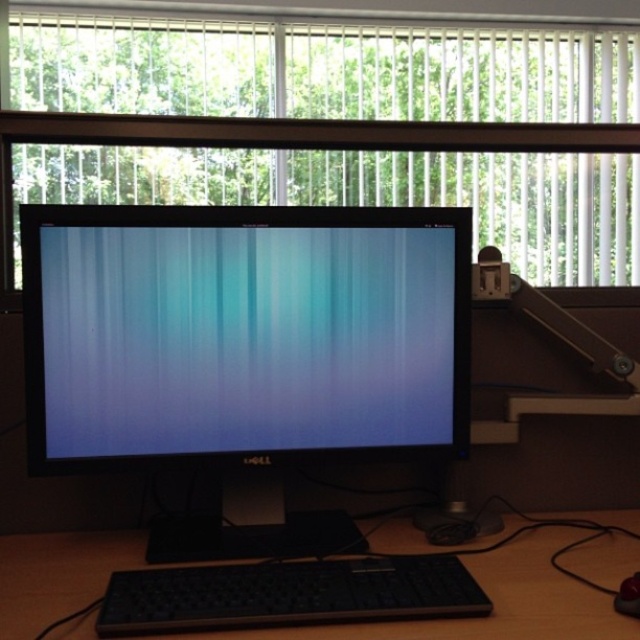
Question: Can you confirm if black plastic keyboard at lower center is positioned to the left of black plastic mouse at lower right?

Choices:
 (A) no
 (B) yes

Answer: (B)

Question: Is wooden table at lower center further to camera compared to black plastic keyboard at lower center?

Choices:
 (A) yes
 (B) no

Answer: (A)

Question: Estimate the real-world distances between objects in this image. Which object is closer to the matte black monitor at center?

Choices:
 (A) wooden table at lower center
 (B) transparent plastic window at upper center

Answer: (A)

Question: Which of the following is the farthest from the observer?

Choices:
 (A) black plastic mouse at lower right
 (B) transparent plastic window at upper center

Answer: (B)

Question: Which of the following is the farthest from the observer?

Choices:
 (A) black plastic keyboard at lower center
 (B) wooden table at lower center
 (C) transparent plastic window at upper center

Answer: (C)

Question: Is wooden table at lower center above black plastic mouse at lower right?

Choices:
 (A) no
 (B) yes

Answer: (A)